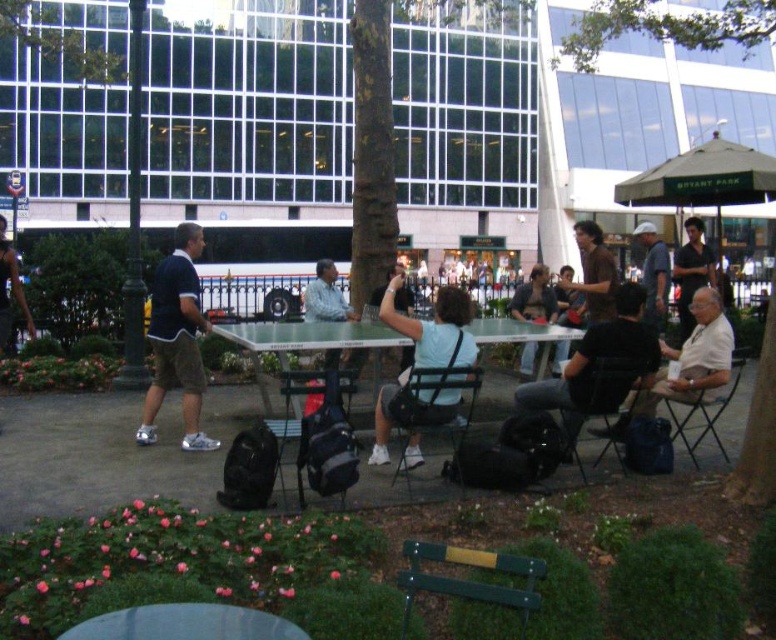
Measure the distance from clear plastic picnic table at center to metallic silver chair at center.

4.16 feet

Is point (319, 333) more distant than point (449, 440)?

No, (319, 333) is closer to viewer.

This screenshot has height=640, width=776. In order to click on clear plastic picnic table at center in this screenshot , I will do `click(303, 340)`.

Is black fabric chair at lower right below matte gray shirt at center-right?

Indeed, black fabric chair at lower right is positioned under matte gray shirt at center-right.

Who is taller, black fabric chair at lower right or matte gray shirt at center-right?

matte gray shirt at center-right

Image resolution: width=776 pixels, height=640 pixels. Identify the location of black fabric chair at lower right. (596, 394).

In order to click on black fabric chair at lower right in this screenshot , I will do `click(596, 394)`.

Does blue fabric shorts at left appear on the right side of dark brown leather jacket at center?

No, blue fabric shorts at left is not to the right of dark brown leather jacket at center.

Does blue fabric shorts at left have a smaller size compared to dark brown leather jacket at center?

Yes, blue fabric shorts at left is smaller than dark brown leather jacket at center.

Who is more distant from viewer, (179, 253) or (563, 317)?

Positioned behind is point (563, 317).

I want to click on blue fabric shorts at left, so click(x=177, y=339).